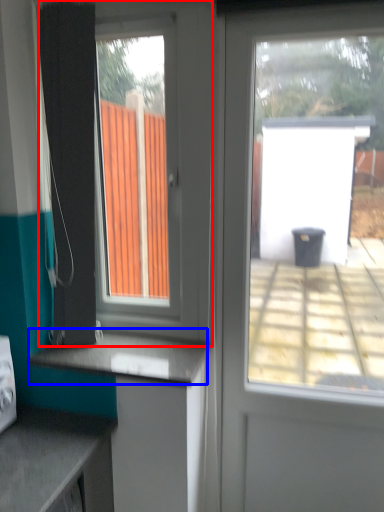
Question: Among these objects, which one is farthest to the camera, window (highlighted by a red box) or counter top (highlighted by a blue box)?

Choices:
 (A) window
 (B) counter top

Answer: (B)